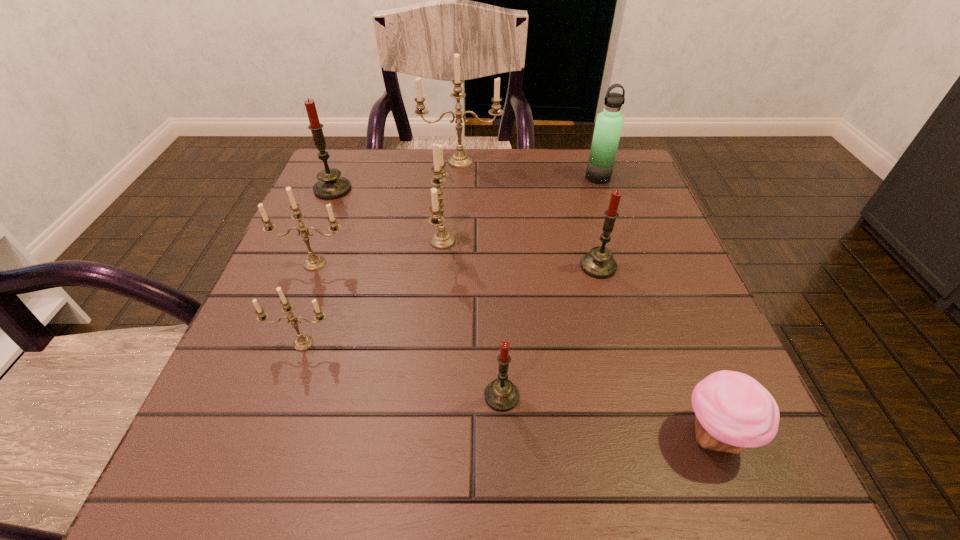
Locate an element on the screen. free area in between the smallest red candle and the smallest metallic candle is located at coordinates (402, 370).

What are the coordinates of `empty space that is in between the second smallest metallic candle and the sixth nearest candle` in the screenshot? It's located at (324, 227).

Find the location of `vacant space that is in between the farthest red candle and the rightmost candle`. vacant space that is in between the farthest red candle and the rightmost candle is located at coordinates (466, 228).

Identify the location of unoccupied area between the pink cupcake and the farthest metallic candle. This screenshot has width=960, height=540. (588, 299).

Identify the location of free space between the biggest red candle and the second smallest metallic candle. Image resolution: width=960 pixels, height=540 pixels. pos(324,227).

The width and height of the screenshot is (960, 540). I want to click on free space between the cupcake and the farthest red candle, so click(x=523, y=312).

At what (x,y) coordinates should I click in order to perform the action: click on free space between the second biggest metallic candle and the second nearest red candle. Please return your answer as a coordinate pair (x, y). The width and height of the screenshot is (960, 540). Looking at the image, I should click on (520, 254).

Find the location of a particular element. The height and width of the screenshot is (540, 960). free space between the second nearest candle and the rightmost red candle is located at coordinates click(x=451, y=305).

Image resolution: width=960 pixels, height=540 pixels. Identify the location of blank region between the second red candle from right to left and the leftmost red candle. (418, 293).

At what (x,y) coordinates should I click in order to perform the action: click on free space that is in between the third biggest metallic candle and the biggest red candle. Please return your answer as a coordinate pair (x, y). The width and height of the screenshot is (960, 540). Looking at the image, I should click on (324, 227).